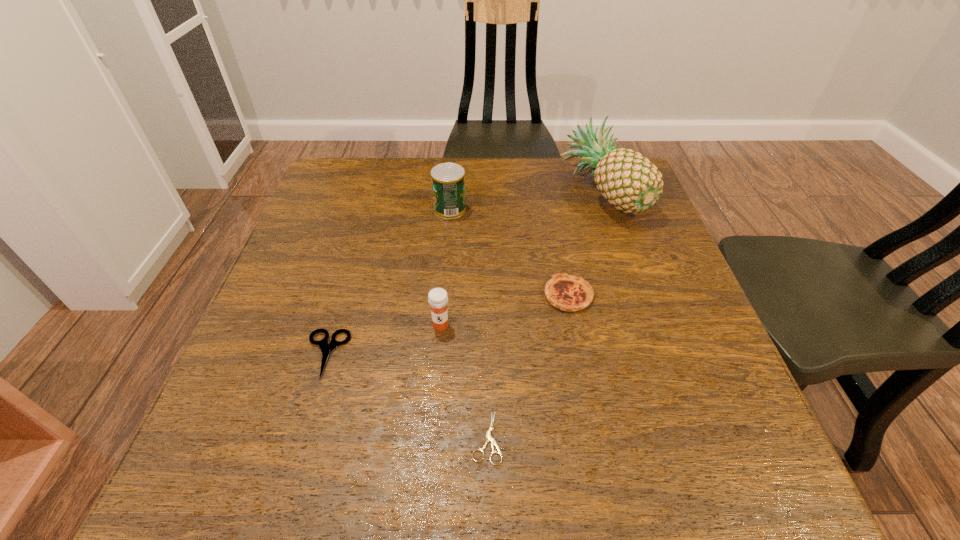
Locate an element on the screen. pineapple is located at coordinates (628, 180).

Locate an element on the screen. The image size is (960, 540). the second tallest object is located at coordinates (448, 179).

At what (x,y) coordinates should I click in order to perform the action: click on medicine. Please return your answer as a coordinate pair (x, y). The image size is (960, 540). Looking at the image, I should click on (437, 297).

I want to click on the fourth nearest object, so [569, 293].

Locate an element on the screen. quiche is located at coordinates (569, 293).

You are a GUI agent. You are given a task and a screenshot of the screen. Output one action in this format:
    pyautogui.click(x=<x>, y=<y>)
    Task: Click on the taller shears
    The width and height of the screenshot is (960, 540).
    Given the screenshot: What is the action you would take?
    pyautogui.click(x=326, y=348)

Locate an element on the screen. The height and width of the screenshot is (540, 960). the leftmost object is located at coordinates (326, 348).

Image resolution: width=960 pixels, height=540 pixels. Find the location of `the third object from right to left`. the third object from right to left is located at coordinates (489, 438).

You are a GUI agent. You are given a task and a screenshot of the screen. Output one action in this format:
    pyautogui.click(x=<x>, y=<y>)
    Task: Click on the nearer shears
    
    Given the screenshot: What is the action you would take?
    pyautogui.click(x=489, y=438)

Where is `vacant space located 0.400m on the front of the pineapple`? vacant space located 0.400m on the front of the pineapple is located at coordinates (660, 369).